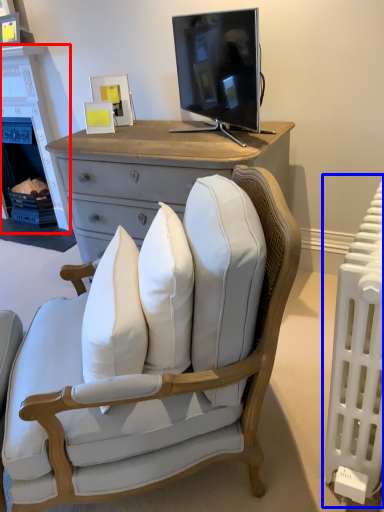
Question: Which point is further to the camera, fireplace (highlighted by a red box) or radiator (highlighted by a blue box)?

Choices:
 (A) fireplace
 (B) radiator

Answer: (A)